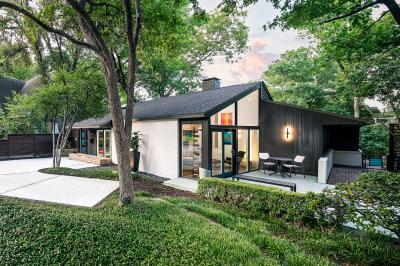
At what (x,y) coordinates should I click in order to perform the action: click on white and black modern looking home. Please return your answer as a coordinate pair (x, y). Looking at the image, I should click on (176, 145), (301, 140).